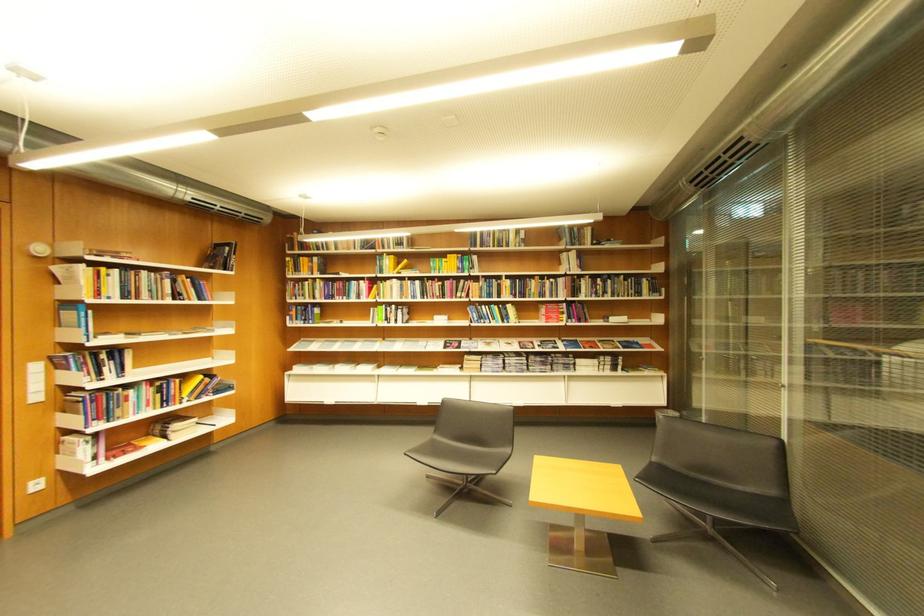
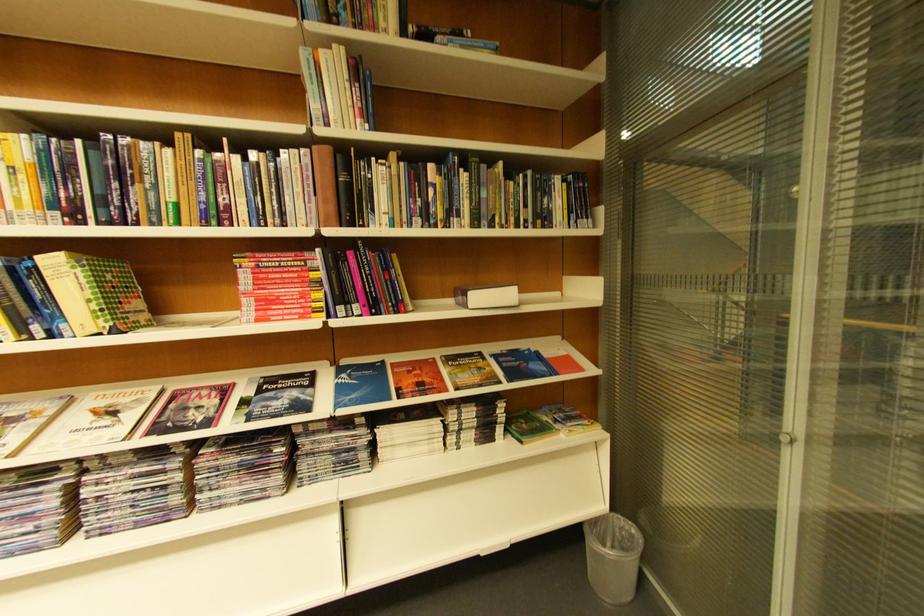
In the second image, find the point that corresponds to the point at 580,291 in the first image.

(342, 196)